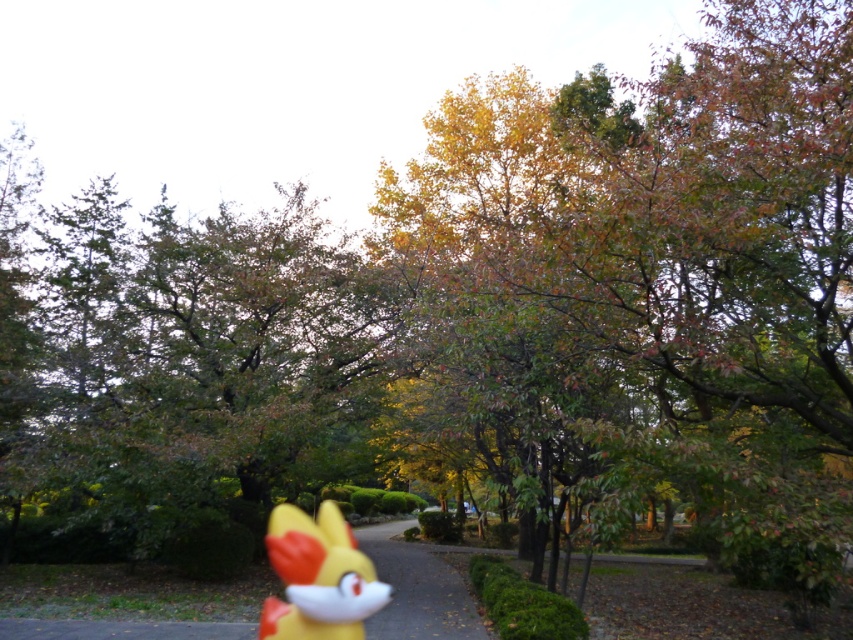
You are a child who wants to pick up both the yellow plastic toy at center and the yellow matte toy at center from the park. Which one should you pick up first if you want to start with the larger one?

The yellow plastic toy at center is bigger than the yellow matte toy at center, so you should pick up the yellow plastic toy at center first.